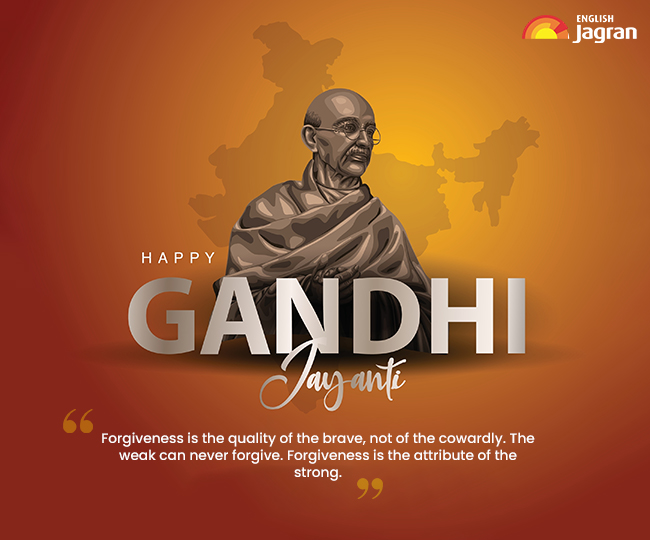
This screenshot has width=650, height=540. In order to click on robes in this screenshot , I will do `click(340, 237)`.